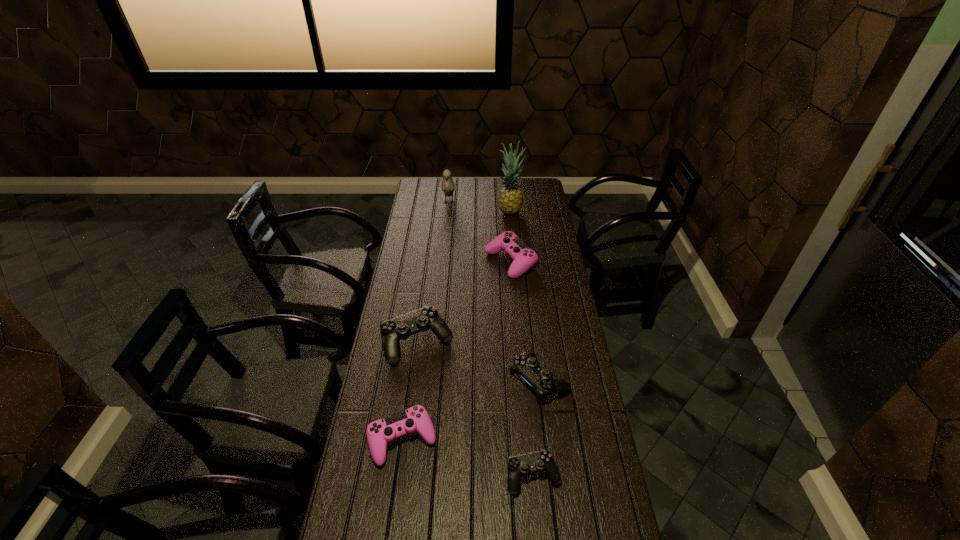
The height and width of the screenshot is (540, 960). Find the location of `unoccupied area between the leftmost black control and the smallest black control`. unoccupied area between the leftmost black control and the smallest black control is located at coordinates (475, 409).

Where is `empty location between the bird and the biggest black control`? The height and width of the screenshot is (540, 960). empty location between the bird and the biggest black control is located at coordinates (433, 272).

This screenshot has width=960, height=540. Identify the location of vacant area that lies between the leftmost black control and the second biggest black control. (478, 361).

Find the location of a particular element. This screenshot has width=960, height=540. vacant space in between the nearest black control and the second tallest object is located at coordinates (492, 339).

Locate an element on the screen. free space between the yellow pineapple and the bird is located at coordinates (479, 207).

The height and width of the screenshot is (540, 960). What are the coordinates of `object that ranks as the sixth closest to the leftmost black control` in the screenshot? It's located at (448, 186).

Identify which object is the sixth closest to the second biggest black control. Please provide its 2D coordinates. Your answer should be formatted as a tuple, i.e. [(x, y)], where the tuple contains the x and y coordinates of a point satisfying the conditions above.

[(448, 186)]

Where is `control that stands as the closest to the second biggest black control`? control that stands as the closest to the second biggest black control is located at coordinates (540, 461).

Identify the location of control that stands as the closest to the biggest black control. (415, 419).

Locate an element on the screen. the second closest black control to the bird is located at coordinates (526, 365).